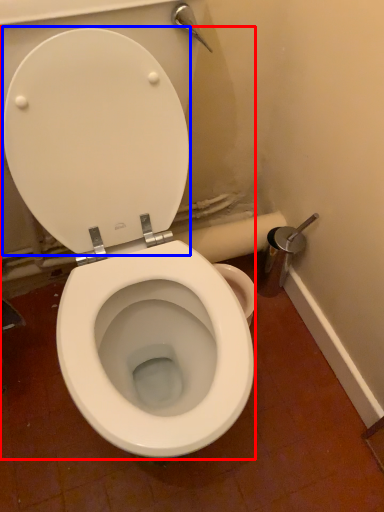
Question: Among these objects, which one is nearest to the camera, toilet (highlighted by a red box) or back (highlighted by a blue box)?

Choices:
 (A) toilet
 (B) back

Answer: (A)